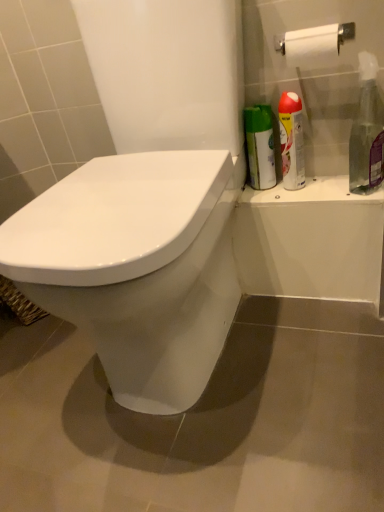
Question: From a real-world perspective, does silver metallic spray can at upper right, the 2th cleaning product in the right-to-left sequence, sit lower than white glossy toilet at center?

Choices:
 (A) yes
 (B) no

Answer: (B)

Question: Does silver metallic spray can at upper right, the 2th cleaning product in the right-to-left sequence, have a greater width compared to white glossy toilet at center?

Choices:
 (A) no
 (B) yes

Answer: (A)

Question: Are silver metallic spray can at upper right, which is the 1th cleaning product from left to right, and white glossy toilet at center located far from each other?

Choices:
 (A) yes
 (B) no

Answer: (B)

Question: Does silver metallic spray can at upper right, the 2th cleaning product in the right-to-left sequence, lie in front of white glossy toilet at center?

Choices:
 (A) no
 (B) yes

Answer: (A)

Question: Does silver metallic spray can at upper right, the 2th cleaning product in the right-to-left sequence, turn towards white glossy toilet at center?

Choices:
 (A) no
 (B) yes

Answer: (A)

Question: Is silver metallic spray can at upper right, the 2th cleaning product in the right-to-left sequence, bigger or smaller than white glossy toilet at center?

Choices:
 (A) small
 (B) big

Answer: (A)

Question: Is silver metallic spray can at upper right, the 2th cleaning product in the right-to-left sequence, situated inside white glossy toilet at center or outside?

Choices:
 (A) inside
 (B) outside

Answer: (B)

Question: Considering their positions, is silver metallic spray can at upper right, which is the 1th cleaning product from left to right, located in front of or behind white glossy toilet at center?

Choices:
 (A) behind
 (B) front

Answer: (A)

Question: From their relative heights in the image, would you say silver metallic spray can at upper right, the 2th cleaning product in the right-to-left sequence, is taller or shorter than white glossy toilet at center?

Choices:
 (A) tall
 (B) short

Answer: (B)

Question: From a real-world perspective, is white glossy toilet at center positioned above or below clear plastic spray bottle at right, marked as the 2th cleaning product in a left-to-right arrangement?

Choices:
 (A) below
 (B) above

Answer: (A)

Question: From the image's perspective, is white glossy toilet at center above or below clear plastic spray bottle at right, the first cleaning product from the right?

Choices:
 (A) above
 (B) below

Answer: (B)

Question: In terms of width, does white glossy toilet at center look wider or thinner when compared to clear plastic spray bottle at right, the first cleaning product from the right?

Choices:
 (A) wide
 (B) thin

Answer: (A)

Question: From their relative heights in the image, would you say white glossy toilet at center is taller or shorter than clear plastic spray bottle at right, the first cleaning product from the right?

Choices:
 (A) tall
 (B) short

Answer: (A)

Question: Is clear plastic spray bottle at right, marked as the 2th cleaning product in a left-to-right arrangement, in front of or behind white glossy toilet at center in the image?

Choices:
 (A) behind
 (B) front

Answer: (A)

Question: Based on their positions, is clear plastic spray bottle at right, marked as the 2th cleaning product in a left-to-right arrangement, located to the left or right of white glossy toilet at center?

Choices:
 (A) left
 (B) right

Answer: (B)